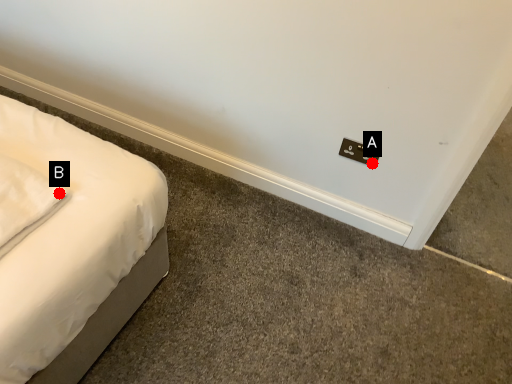
Question: Two points are circled on the image, labeled by A and B beside each circle. Which point appears closest to the camera in this image?

Choices:
 (A) A is closer
 (B) B is closer

Answer: (B)